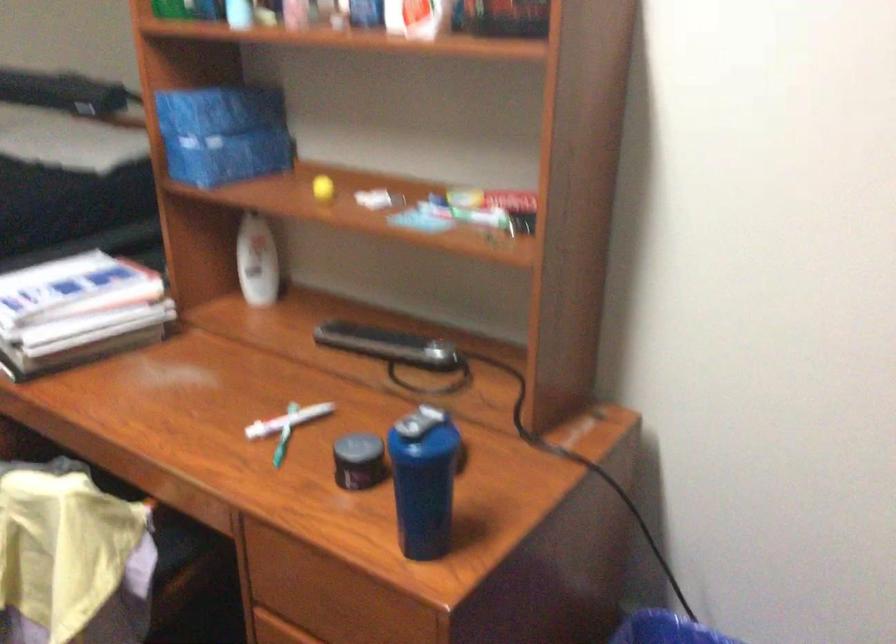
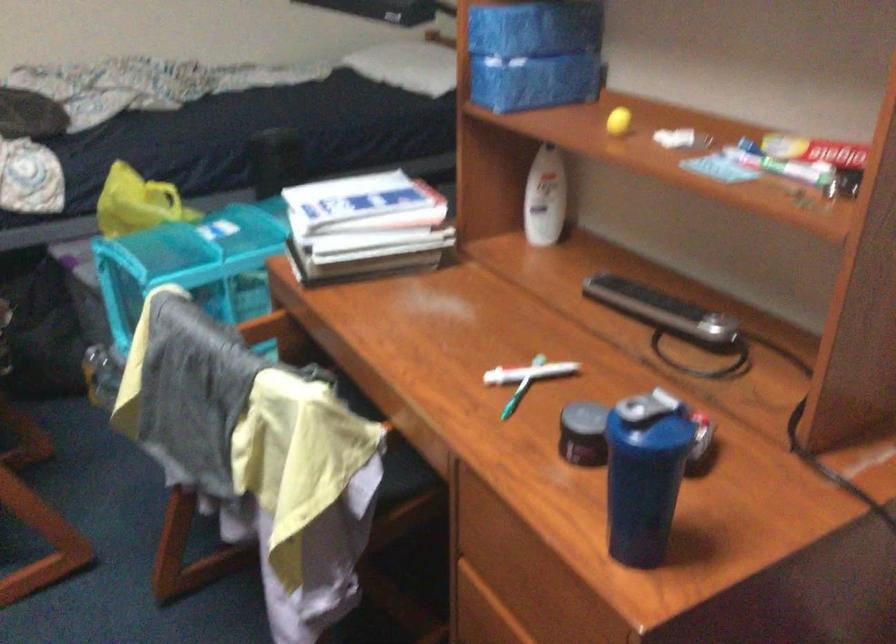
Locate, in the second image, the point that corresponds to (x=288, y=422) in the first image.

(529, 373)